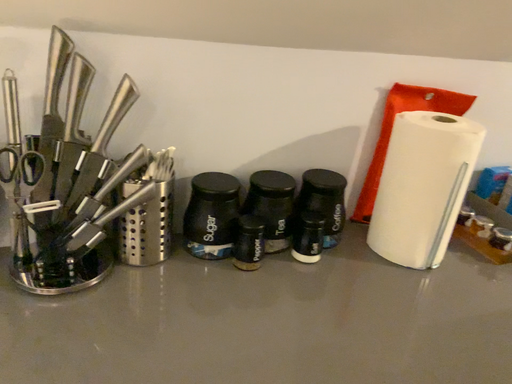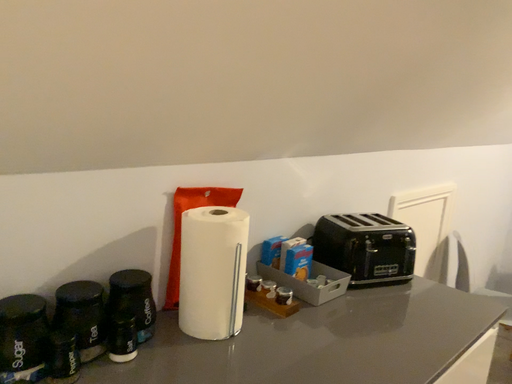
Question: Which way did the camera rotate in the video?

Choices:
 (A) rotated left
 (B) rotated right

Answer: (B)